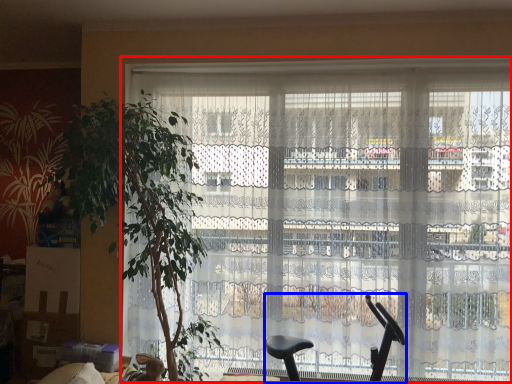
Question: Which point is closer to the camera, window (highlighted by a red box) or baby carriage (highlighted by a blue box)?

Choices:
 (A) window
 (B) baby carriage

Answer: (B)